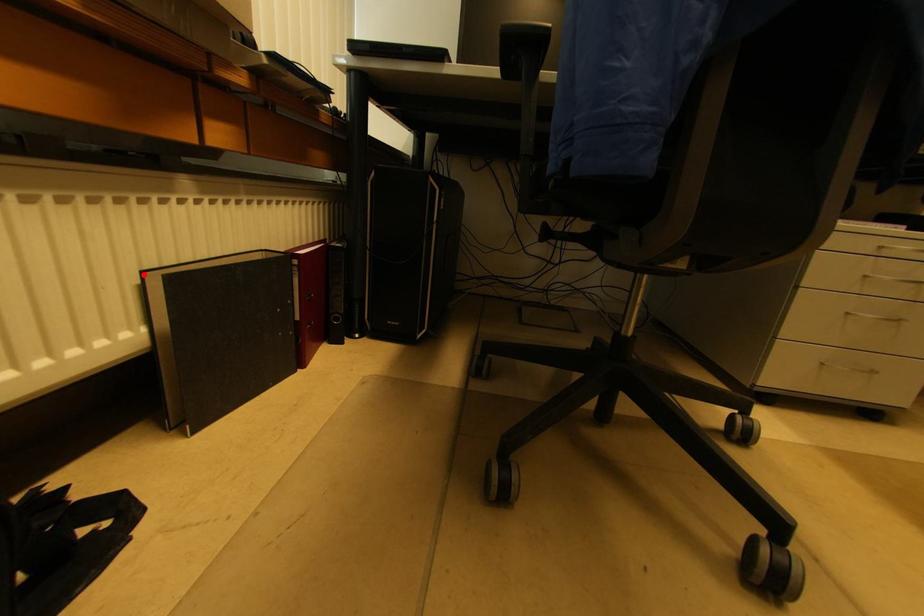
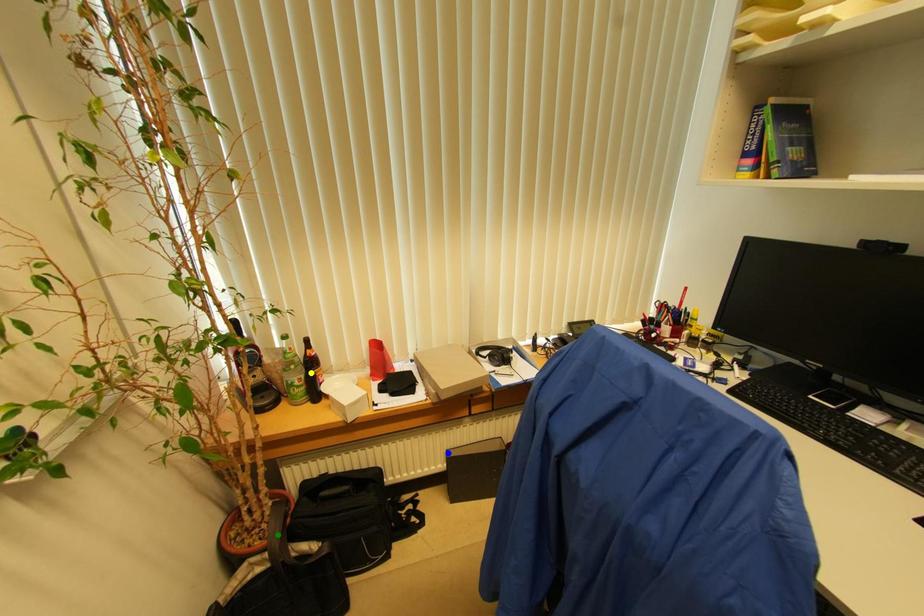
Question: I am providing you with two images of the same scene from different viewpoints. A red point is marked on the first image. You are given multiple points on the second image. Can you choose the point in image 2 that corresponds to the point in image 1?

Choices:
 (A) yellow point
 (B) green point
 (C) blue point

Answer: (C)